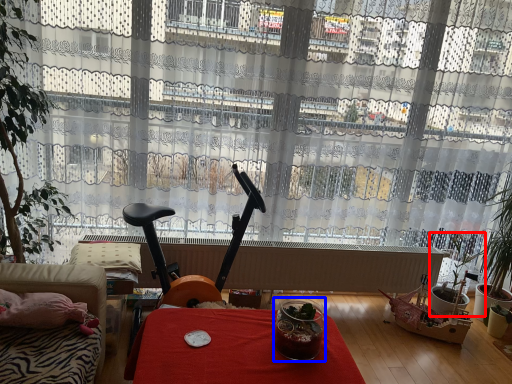
Question: Which object is closer to the camera taking this photo, houseplant (highlighted by a red box) or glass jar (highlighted by a blue box)?

Choices:
 (A) houseplant
 (B) glass jar

Answer: (B)